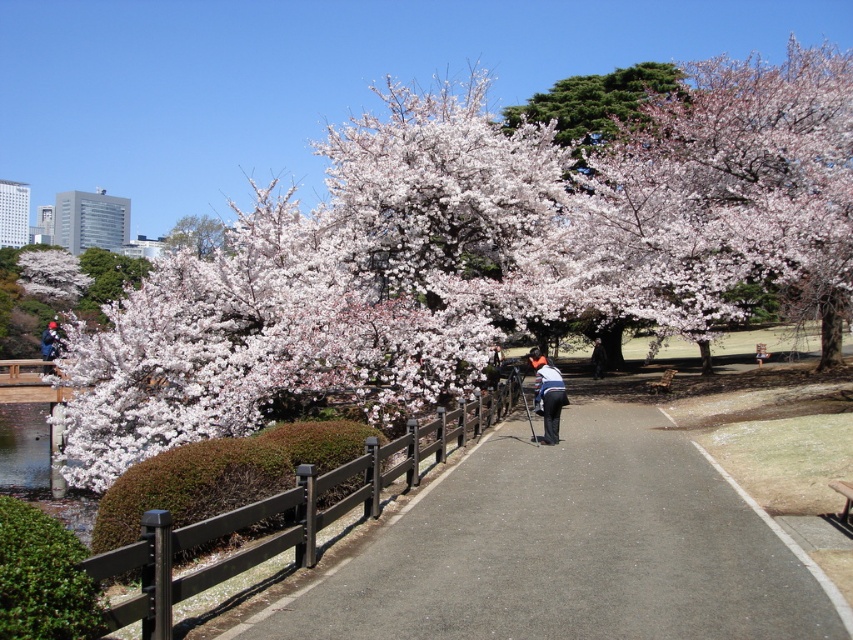
Is white matte blossoms at upper left below white blossoms at upper left?

Yes, white matte blossoms at upper left is below white blossoms at upper left.

Who is higher up, white matte blossoms at upper left or white blossoms at upper left?

Positioned higher is white blossoms at upper left.

At what (x,y) coordinates should I click in order to perform the action: click on white matte blossoms at upper left. Please return your answer as a coordinate pair (x, y). The width and height of the screenshot is (853, 640). Looking at the image, I should click on (51, 275).

Identify the location of white matte blossoms at upper left. (51, 275).

Is white matte blossoms at left wider than orange fabric jacket at center?

Yes.

From the picture: Is white matte blossoms at left further to camera compared to orange fabric jacket at center?

Yes, it is.

In order to click on white matte blossoms at left in this screenshot , I will do `click(480, 256)`.

Locate an element on the screen. The width and height of the screenshot is (853, 640). white matte blossoms at left is located at coordinates (x=480, y=256).

Is white matte blossoms at left shorter than white blossoms at upper left?

No.

Which is behind, point (647, 186) or point (173, 230)?

Positioned behind is point (173, 230).

This screenshot has width=853, height=640. I want to click on white matte blossoms at left, so pyautogui.click(x=480, y=256).